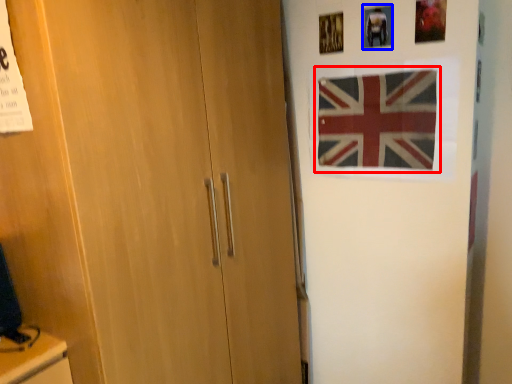
Question: Which object is further to the camera taking this photo, flag (highlighted by a red box) or picture frame (highlighted by a blue box)?

Choices:
 (A) flag
 (B) picture frame

Answer: (B)